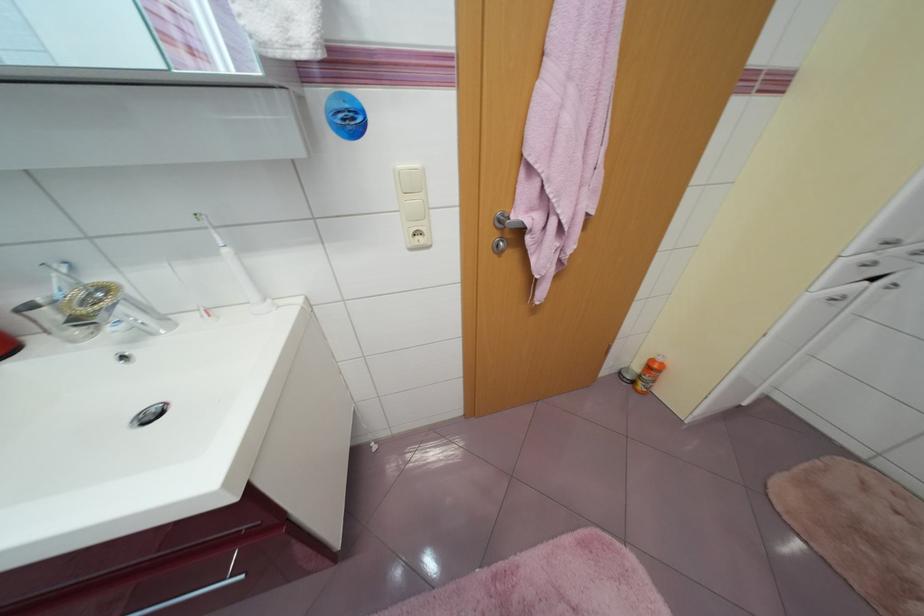
In order to click on white light switch in this screenshot , I will do `click(410, 192)`.